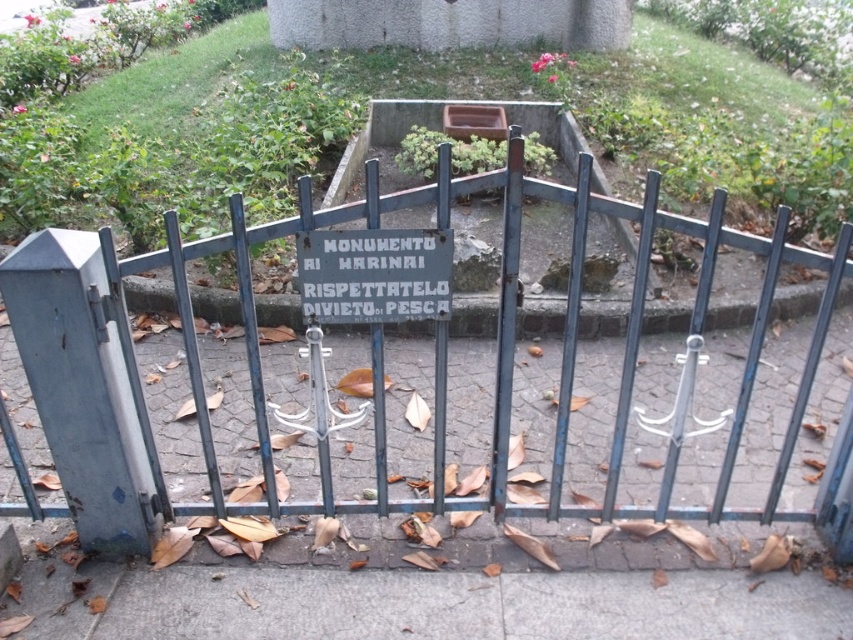
Question: Where is gray metallic gate at left located in relation to white stone sign at center in the image?

Choices:
 (A) below
 (B) above

Answer: (A)

Question: Can you confirm if blue painted metal gate at center is smaller than white stone sign at center?

Choices:
 (A) yes
 (B) no

Answer: (B)

Question: Is gray metallic gate at left above white stone sign at center?

Choices:
 (A) no
 (B) yes

Answer: (A)

Question: Which point is farther to the camera?

Choices:
 (A) gray metallic gate at left
 (B) white stone sign at center

Answer: (B)

Question: Estimate the real-world distances between objects in this image. Which object is farther from the gray metallic gate at left?

Choices:
 (A) white stone sign at center
 (B) blue painted metal gate at center

Answer: (A)

Question: Which object is closer to the camera taking this photo?

Choices:
 (A) gray metallic gate at left
 (B) white stone sign at center

Answer: (A)